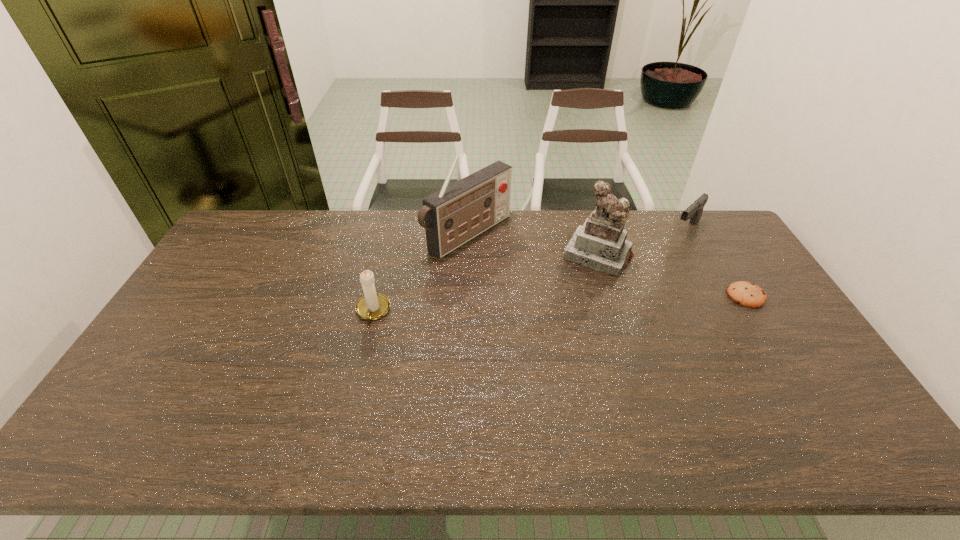
Find the location of a particular element. This screenshot has width=960, height=540. figurine situated at the far edge is located at coordinates (600, 244).

Where is `cookie that is at the right edge`? This screenshot has height=540, width=960. cookie that is at the right edge is located at coordinates (747, 294).

You are a GUI agent. You are given a task and a screenshot of the screen. Output one action in this format:
    pyautogui.click(x=<x>, y=<y>)
    Task: Click on the pistol at the right edge
    This screenshot has width=960, height=540.
    Given the screenshot: What is the action you would take?
    pyautogui.click(x=694, y=212)

Identify the location of object at the far right corner. (694, 212).

Image resolution: width=960 pixels, height=540 pixels. What are the coordinates of `free space at the far edge` in the screenshot? It's located at (316, 220).

Find the location of a particular element. Image resolution: width=960 pixels, height=540 pixels. free spot at the near edge of the desktop is located at coordinates (598, 408).

In the image, there is a desktop. Where is `vacant space at the left edge`? vacant space at the left edge is located at coordinates (203, 353).

Image resolution: width=960 pixels, height=540 pixels. In order to click on free space that is in between the fourth object from right to left and the figurine in this screenshot , I will do `click(533, 245)`.

You are a GUI agent. You are given a task and a screenshot of the screen. Output one action in this format:
    pyautogui.click(x=<x>, y=<y>)
    Task: Click on the empty space between the third tallest object and the third object from right to left
    The width and height of the screenshot is (960, 540).
    Given the screenshot: What is the action you would take?
    pyautogui.click(x=486, y=283)

Find the location of a particular element. vacant space that's between the candle holder and the radio receiver is located at coordinates (420, 273).